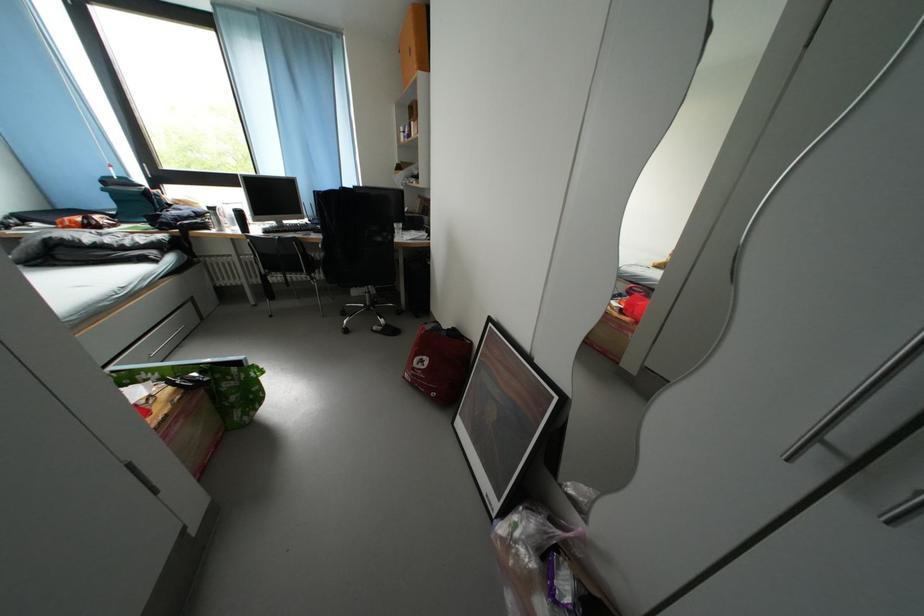
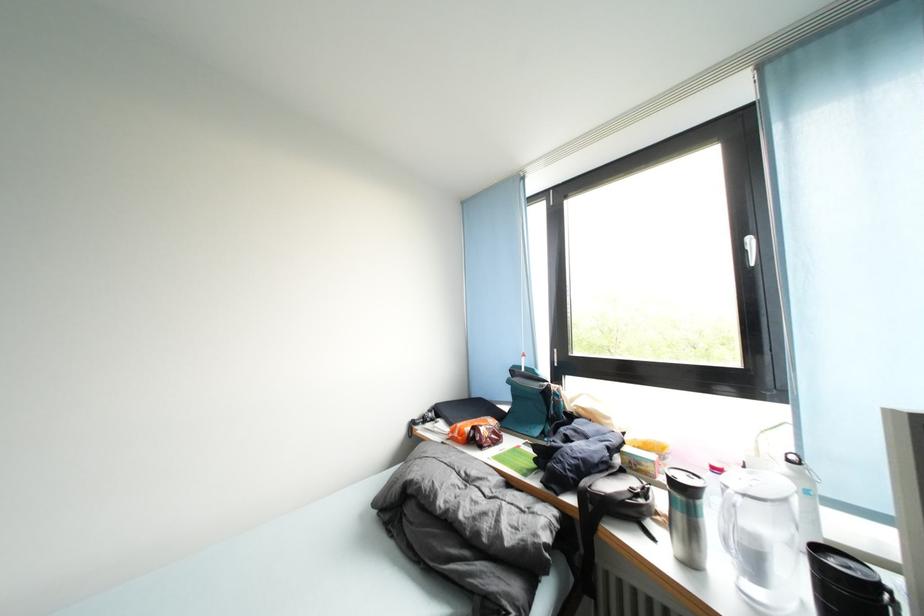
In the second image, find the point that corresponds to point (100, 231) in the first image.

(482, 446)